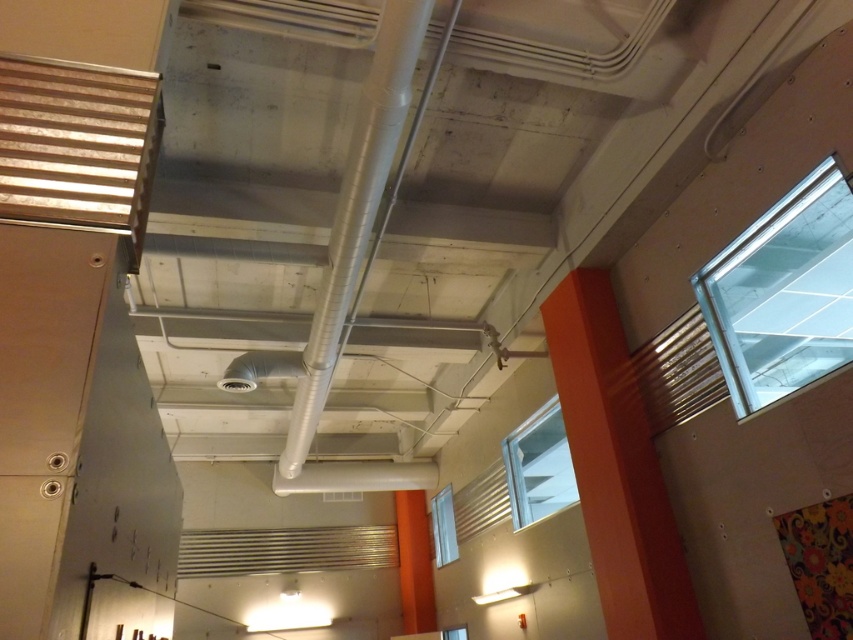
Does orange matte pillar at center have a larger size compared to silver metallic pipe at center?

No.

Between point (583, 364) and point (376, 154), which one is positioned in front?

Point (376, 154)

Locate an element on the screen. Image resolution: width=853 pixels, height=640 pixels. orange matte pillar at center is located at coordinates (616, 467).